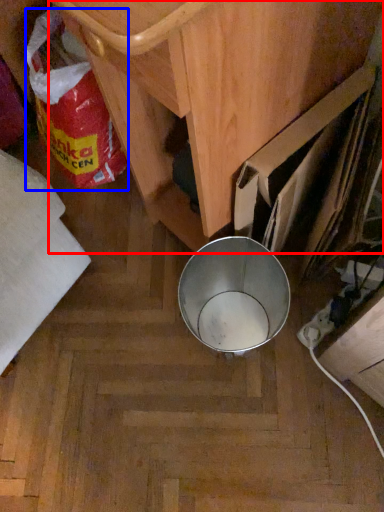
Question: Among these objects, which one is nearest to the camera, furniture (highlighted by a red box) or waste (highlighted by a blue box)?

Choices:
 (A) furniture
 (B) waste

Answer: (A)